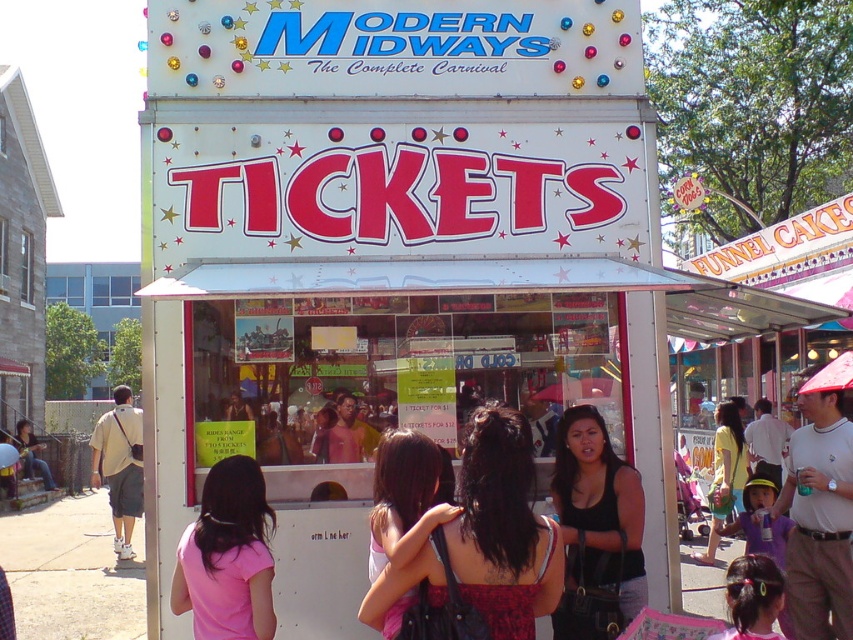
You are a photographer at the carnival trying to capture a clear shot of the woman in the center. Since you want to focus on her face, which part should you adjust your camera to prioritize? The matte black hair at center or the black matte tank top at center?

The matte black hair at center has a lesser height compared to the black matte tank top at center. Therefore, to focus on her face, you should prioritize adjusting the camera to the matte black hair at center since it is closer to the face and lower in height.